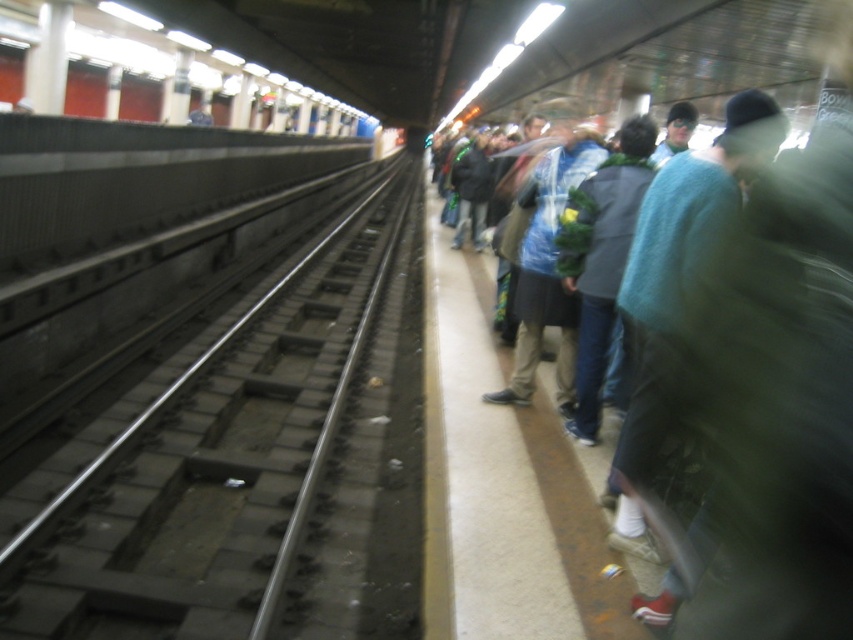
Is point (235, 513) closer to viewer compared to point (308, 97)?

Yes.

Does concrete track at left appear on the right side of metallic gray train at upper left?

Yes, concrete track at left is to the right of metallic gray train at upper left.

I want to click on concrete track at left, so click(x=212, y=461).